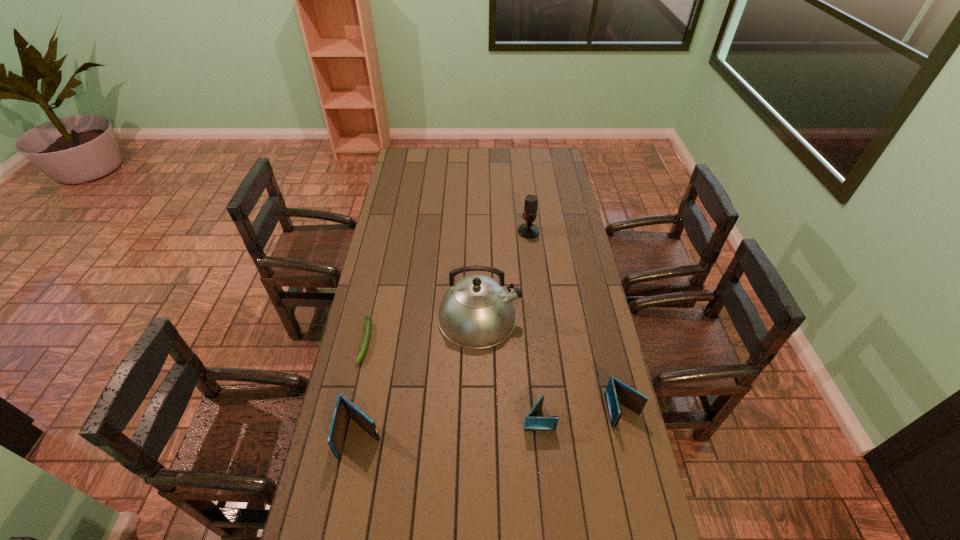
If equal spacing is the goal by inserting an additional wallet among them, please point out a vacant space for this new wallet. Please provide its 2D coordinates. Your answer should be formatted as a tuple, i.e. [(x, y)], where the tuple contains the x and y coordinates of a point satisfying the conditions above.

[(451, 427)]